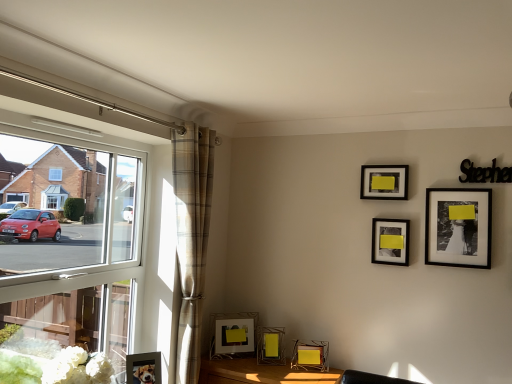
You are a GUI agent. You are given a task and a screenshot of the screen. Output one action in this format:
    pyautogui.click(x=<x>, y=<y>)
    Task: Click on the matte black picture frame at upper right, the fifth picture frame in the left-to-right sequence
    The height and width of the screenshot is (384, 512).
    Given the screenshot: What is the action you would take?
    pyautogui.click(x=384, y=182)

Locate an element on the screen. This screenshot has width=512, height=384. plaid fabric curtain at left is located at coordinates (191, 238).

This screenshot has height=384, width=512. What do you see at coordinates (191, 238) in the screenshot?
I see `plaid fabric curtain at left` at bounding box center [191, 238].

The width and height of the screenshot is (512, 384). Identify the location of metallic wireframe picture frame at lower center, which is the fourth picture frame in left-to-right order. (310, 356).

At what (x,y) coordinates should I click in order to perform the action: click on matte black picture frame at center, which is the 2th picture frame from right to left. Please return your answer as a coordinate pair (x, y). Looking at the image, I should click on (390, 241).

From their relative heights in the image, would you say plaid fabric curtain at left is taller or shorter than white matte floral arrangement at lower left?

plaid fabric curtain at left is taller than white matte floral arrangement at lower left.

Is plaid fabric curtain at left at the left side of white matte floral arrangement at lower left?

Incorrect, plaid fabric curtain at left is not on the left side of white matte floral arrangement at lower left.

In the scene shown: Are plaid fabric curtain at left and white matte floral arrangement at lower left beside each other?

No, plaid fabric curtain at left is not touching white matte floral arrangement at lower left.

In terms of width, does plaid fabric curtain at left look wider or thinner when compared to white matte floral arrangement at lower left?

Considering their sizes, plaid fabric curtain at left looks slimmer than white matte floral arrangement at lower left.

Considering the points (262, 333) and (376, 227), which point is in front, point (262, 333) or point (376, 227)?

The point (376, 227) is in front.

From a real-world perspective, is matte yellow picture frame at lower center, which appears as the 5th picture frame when viewed from the right, above or below matte black picture frame at center, which is the 2th picture frame from right to left?

matte yellow picture frame at lower center, which appears as the 5th picture frame when viewed from the right, is situated lower than matte black picture frame at center, which is the 2th picture frame from right to left, in the real world.

Does matte yellow picture frame at lower center, which appears as the 5th picture frame when viewed from the right, lie behind matte black picture frame at center, which is the 2th picture frame from right to left?

Yes.

Considering the relative sizes of white matte floral arrangement at lower left and metallic silver picture frame at lower left, the 7th picture frame when ordered from right to left, in the image provided, is white matte floral arrangement at lower left wider than metallic silver picture frame at lower left, the 7th picture frame when ordered from right to left,?

Yes.

Does point (55, 364) come behind point (146, 372)?

No, (55, 364) is closer to viewer.

I want to click on picture frame that is the 2nd object located behind the white matte floral arrangement at lower left, so click(x=143, y=368).

Is matte yellow picture frame at lower center, which appears as the 5th picture frame when viewed from the right, located within metallic gold table at lower center?

No, matte yellow picture frame at lower center, which appears as the 5th picture frame when viewed from the right, is located outside of metallic gold table at lower center.

From a real-world perspective, is metallic gold table at lower center under matte yellow picture frame at lower center, which appears as the 5th picture frame when viewed from the right?

Yes, from a real-world perspective, metallic gold table at lower center is beneath matte yellow picture frame at lower center, which appears as the 5th picture frame when viewed from the right.

Is metallic gold table at lower center placed right next to matte yellow picture frame at lower center, which appears as the 5th picture frame when viewed from the right?

No.

From a real-world perspective, who is located higher, black matte picture frame at upper right, the 1th picture frame viewed from the right, or matte glass picture frame at lower center, marked as the 6th picture frame in a right-to-left arrangement?

black matte picture frame at upper right, the 1th picture frame viewed from the right, is physically above.

Can you confirm if black matte picture frame at upper right, the seventh picture frame positioned from the left, is shorter than matte glass picture frame at lower center, marked as the 6th picture frame in a right-to-left arrangement?

Incorrect, the height of black matte picture frame at upper right, the seventh picture frame positioned from the left, does not fall short of that of matte glass picture frame at lower center, marked as the 6th picture frame in a right-to-left arrangement.

Can matte glass picture frame at lower center, the 2th picture frame in the left-to-right sequence, be found inside black matte picture frame at upper right, the 1th picture frame viewed from the right?

No, black matte picture frame at upper right, the 1th picture frame viewed from the right, does not contain matte glass picture frame at lower center, the 2th picture frame in the left-to-right sequence.

Find the location of a particular element. picture frame that is the 2nd one when counting upward from the matte glass picture frame at lower center, the 2th picture frame in the left-to-right sequence (from the image's perspective) is located at coordinates (458, 227).

Is matte black picture frame at upper right, positioned as the 3th picture frame in right-to-left order, further to camera compared to plaid fabric curtain at left?

Yes, the depth of matte black picture frame at upper right, positioned as the 3th picture frame in right-to-left order, is greater than that of plaid fabric curtain at left.

Considering the relative sizes of matte black picture frame at upper right, positioned as the 3th picture frame in right-to-left order, and plaid fabric curtain at left in the image provided, is matte black picture frame at upper right, positioned as the 3th picture frame in right-to-left order, wider than plaid fabric curtain at left?

In fact, matte black picture frame at upper right, positioned as the 3th picture frame in right-to-left order, might be narrower than plaid fabric curtain at left.

Is matte black picture frame at upper right, the fifth picture frame in the left-to-right sequence, aimed at plaid fabric curtain at left?

No, matte black picture frame at upper right, the fifth picture frame in the left-to-right sequence, is not facing towards plaid fabric curtain at left.

Find the location of a particular element. the 3rd picture frame above the plaid fabric curtain at left (from the image's perspective) is located at coordinates pos(384,182).

Is matte glass picture frame at lower center, marked as the 6th picture frame in a right-to-left arrangement, located outside matte black picture frame at upper right, positioned as the 3th picture frame in right-to-left order?

That's correct, matte glass picture frame at lower center, marked as the 6th picture frame in a right-to-left arrangement, is outside of matte black picture frame at upper right, positioned as the 3th picture frame in right-to-left order.

From a real-world perspective, which object stands above the other?

In real-world perspective, matte black picture frame at upper right, positioned as the 3th picture frame in right-to-left order, is above.

In the scene shown: Is the position of matte glass picture frame at lower center, marked as the 6th picture frame in a right-to-left arrangement, less distant than that of matte black picture frame at upper right, the fifth picture frame in the left-to-right sequence?

No, it is not.

You are a GUI agent. You are given a task and a screenshot of the screen. Output one action in this format:
    pyautogui.click(x=<x>, y=<y>)
    Task: Click on the curtain that is behind the white matte floral arrangement at lower left
    
    Given the screenshot: What is the action you would take?
    pyautogui.click(x=191, y=238)

Where is `the 3rd picture frame to the left of the matte black picture frame at center, the sixth picture frame in the left-to-right sequence, starting your count from the anchor`? the 3rd picture frame to the left of the matte black picture frame at center, the sixth picture frame in the left-to-right sequence, starting your count from the anchor is located at coordinates (270, 345).

Consider the image. When comparing their distances from plaid fabric curtain at left, does clear glass window at left or metallic wireframe picture frame at lower center, which is counted as the 4th picture frame, starting from the right, seem further?

Among the two, metallic wireframe picture frame at lower center, which is counted as the 4th picture frame, starting from the right, is located further to plaid fabric curtain at left.

When comparing their distances from metallic wireframe picture frame at lower center, which is counted as the 4th picture frame, starting from the right, does clear glass window at left or white matte floral arrangement at lower left seem further?

Among the two, clear glass window at left is located further to metallic wireframe picture frame at lower center, which is counted as the 4th picture frame, starting from the right.

Which object lies nearer to the anchor point matte black picture frame at upper right, the fifth picture frame in the left-to-right sequence, matte glass picture frame at lower center, marked as the 6th picture frame in a right-to-left arrangement, or white matte floral arrangement at lower left?

matte glass picture frame at lower center, marked as the 6th picture frame in a right-to-left arrangement, lies closer to matte black picture frame at upper right, the fifth picture frame in the left-to-right sequence, than the other object.

In the scene shown: From the image, which object appears to be farther from white matte floral arrangement at lower left, matte glass picture frame at lower center, marked as the 6th picture frame in a right-to-left arrangement, or clear glass window at left?

matte glass picture frame at lower center, marked as the 6th picture frame in a right-to-left arrangement, is further to white matte floral arrangement at lower left.

Looking at the image, which one is located further to white matte floral arrangement at lower left, black matte picture frame at upper right, the 1th picture frame viewed from the right, or metallic silver picture frame at lower left, positioned as the first picture frame in left-to-right order?

Among the two, black matte picture frame at upper right, the 1th picture frame viewed from the right, is located further to white matte floral arrangement at lower left.

Looking at the image, which one is located further to matte glass picture frame at lower center, marked as the 6th picture frame in a right-to-left arrangement, clear glass window at left or metallic gold table at lower center?

Based on the image, clear glass window at left appears to be further to matte glass picture frame at lower center, marked as the 6th picture frame in a right-to-left arrangement.

Estimate the real-world distances between objects in this image. Which object is further from metallic silver picture frame at lower left, positioned as the first picture frame in left-to-right order, matte black picture frame at upper right, the fifth picture frame in the left-to-right sequence, or metallic gold table at lower center?

Based on the image, matte black picture frame at upper right, the fifth picture frame in the left-to-right sequence, appears to be further to metallic silver picture frame at lower left, positioned as the first picture frame in left-to-right order.

Based on their spatial positions, is matte yellow picture frame at lower center, which appears as the 5th picture frame when viewed from the right, or metallic wireframe picture frame at lower center, which is the fourth picture frame in left-to-right order, closer to matte black picture frame at upper right, positioned as the 3th picture frame in right-to-left order?

metallic wireframe picture frame at lower center, which is the fourth picture frame in left-to-right order, is closer to matte black picture frame at upper right, positioned as the 3th picture frame in right-to-left order.

You are a GUI agent. You are given a task and a screenshot of the screen. Output one action in this format:
    pyautogui.click(x=<x>, y=<y>)
    Task: Click on the curtain located between white matte floral arrangement at lower left and matte yellow picture frame at lower center, the 3th picture frame when ordered from left to right, in the depth direction
    
    Given the screenshot: What is the action you would take?
    pyautogui.click(x=191, y=238)

Where is `curtain between white matte floral arrangement at lower left and metallic silver picture frame at lower left, positioned as the first picture frame in left-to-right order, in the front-back direction`? curtain between white matte floral arrangement at lower left and metallic silver picture frame at lower left, positioned as the first picture frame in left-to-right order, in the front-back direction is located at coordinates (191, 238).

The height and width of the screenshot is (384, 512). Identify the location of curtain between metallic silver picture frame at lower left, the 7th picture frame when ordered from right to left, and matte black picture frame at center, which is the 2th picture frame from right to left. (191, 238).

You are a GUI agent. You are given a task and a screenshot of the screen. Output one action in this format:
    pyautogui.click(x=<x>, y=<y>)
    Task: Click on the picture frame between metallic silver picture frame at lower left, the 7th picture frame when ordered from right to left, and matte yellow picture frame at lower center, which appears as the 5th picture frame when viewed from the right, in the horizontal direction
    
    Given the screenshot: What is the action you would take?
    pyautogui.click(x=232, y=334)